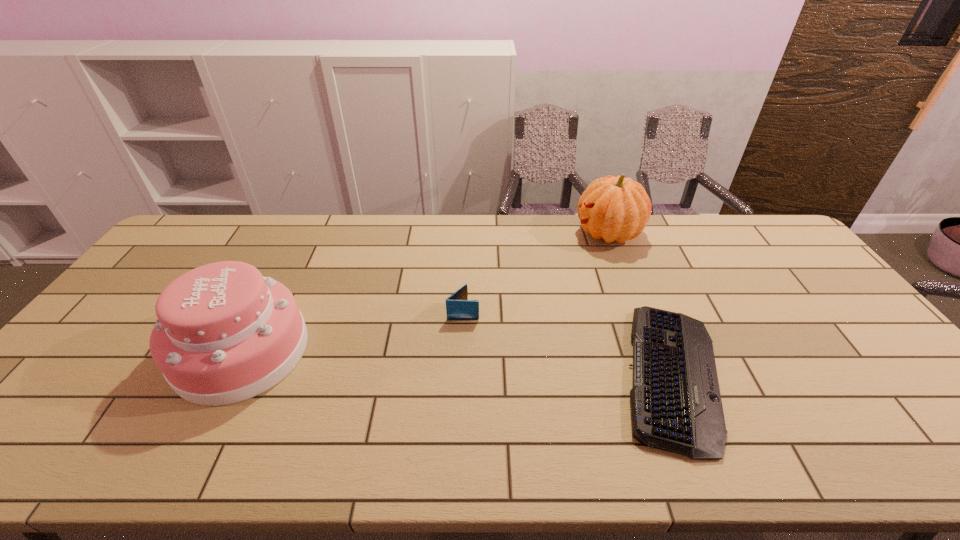
At what (x,y) coordinates should I click in order to perform the action: click on free location that satisfies the following two spatial constraints: 1. on the back side of the computer keyboard; 2. on the exterior surface of the wallet. Please return your answer as a coordinate pair (x, y). This screenshot has width=960, height=540. Looking at the image, I should click on (645, 311).

I want to click on vacant region that satisfies the following two spatial constraints: 1. on the carved face of the pumpkin; 2. on the front side of the leftmost object, so click(653, 351).

Identify the location of free space in the image that satisfies the following two spatial constraints: 1. on the back side of the shortest object; 2. on the carved face of the pumpkin. This screenshot has height=540, width=960. (614, 233).

Image resolution: width=960 pixels, height=540 pixels. What are the coordinates of `vacant region that satisfies the following two spatial constraints: 1. on the exterior surface of the computer keyboard; 2. on the right side of the second object from left to right` in the screenshot? It's located at (461, 375).

I want to click on free space that satisfies the following two spatial constraints: 1. on the carved face of the pumpkin; 2. on the front side of the leftmost object, so click(x=653, y=351).

What are the coordinates of `blank area in the image that satisfies the following two spatial constraints: 1. on the carved face of the farthest object; 2. on the left side of the shortest object` in the screenshot? It's located at [x=661, y=375].